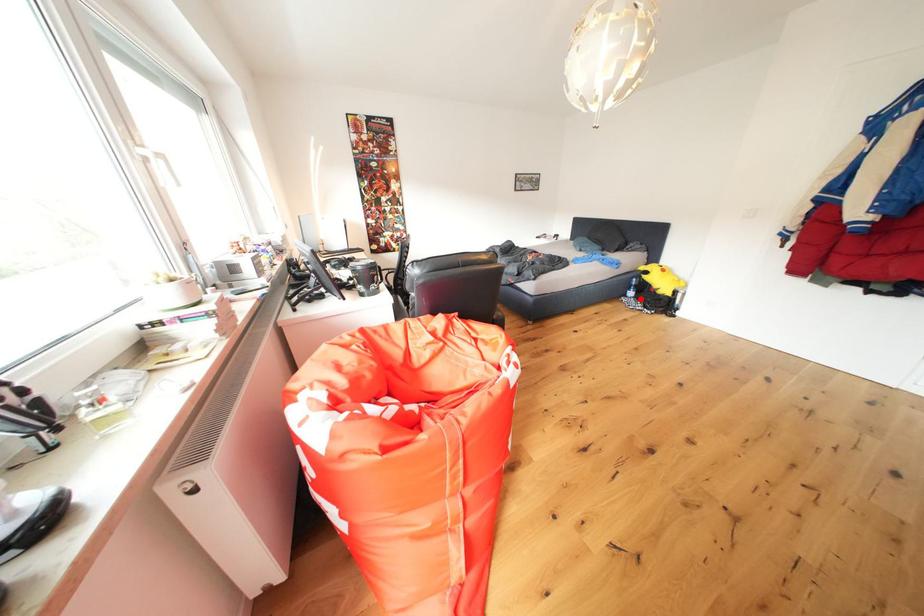
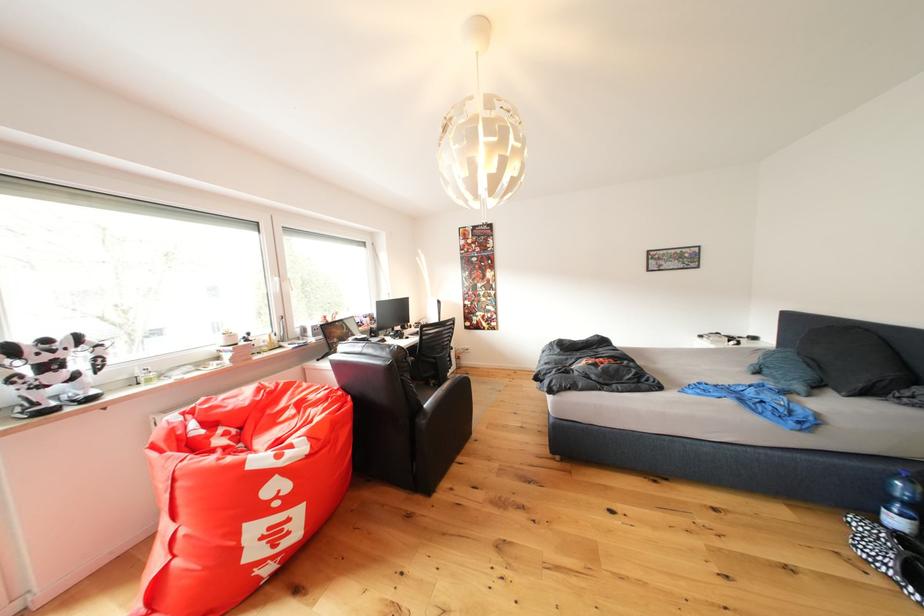
Question: I am providing you with two images of the same scene from different viewpoints. Image1 has a red point marked. In image2, the corresponding 3D location appears at what relative position? Reply with the corresponding letter.

Choices:
 (A) Closer
 (B) Farther

Answer: (B)